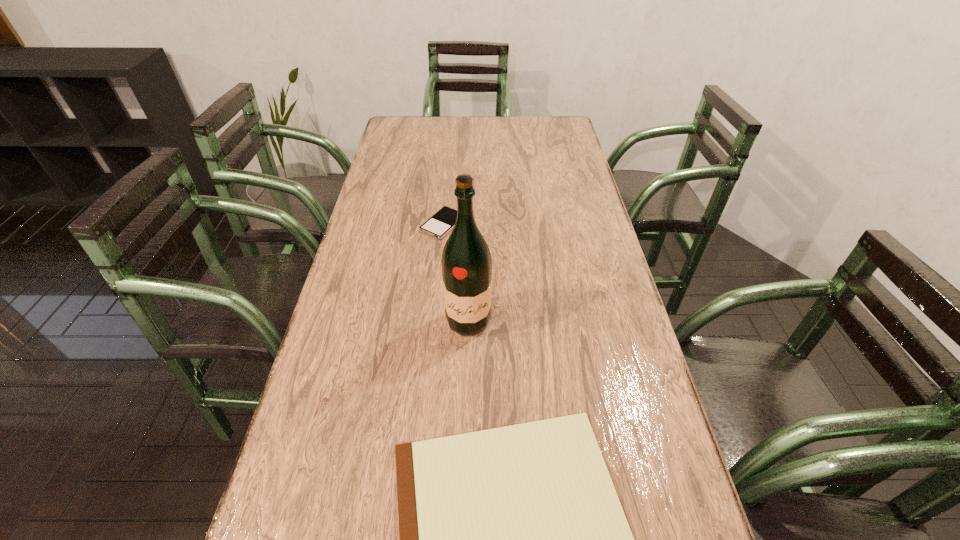
In order to click on the second farthest object in this screenshot , I will do `click(466, 262)`.

Where is `liquor`? Image resolution: width=960 pixels, height=540 pixels. liquor is located at coordinates (466, 262).

This screenshot has height=540, width=960. Identify the location of the farthest object. (441, 223).

You are a GUI agent. You are given a task and a screenshot of the screen. Output one action in this format:
    pyautogui.click(x=<x>, y=<y>)
    Task: Click on the free location located 0.250m on the front-facing side of the liquor
    
    Given the screenshot: What is the action you would take?
    pyautogui.click(x=466, y=438)

Find the location of a particular element. This screenshot has width=960, height=540. free region located 0.130m on the back of the farthest object is located at coordinates (446, 187).

Find the location of `vacant space at the far edge of the desktop`. vacant space at the far edge of the desktop is located at coordinates (465, 123).

At what (x,y) coordinates should I click in order to perform the action: click on free region at the left edge of the desktop. Please return your answer as a coordinate pair (x, y). Looking at the image, I should click on (400, 207).

In the image, there is a desktop. Where is `free space at the right edge`? free space at the right edge is located at coordinates (570, 245).

This screenshot has width=960, height=540. I want to click on vacant space at the far right corner, so click(x=571, y=125).

Locate an element on the screen. This screenshot has height=540, width=960. the second closest object to the tallest object is located at coordinates (441, 223).